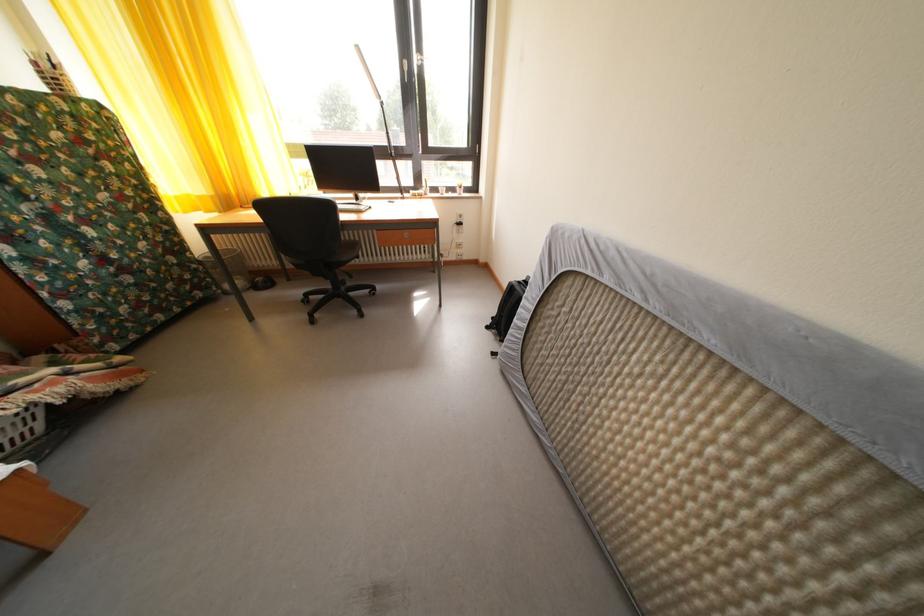
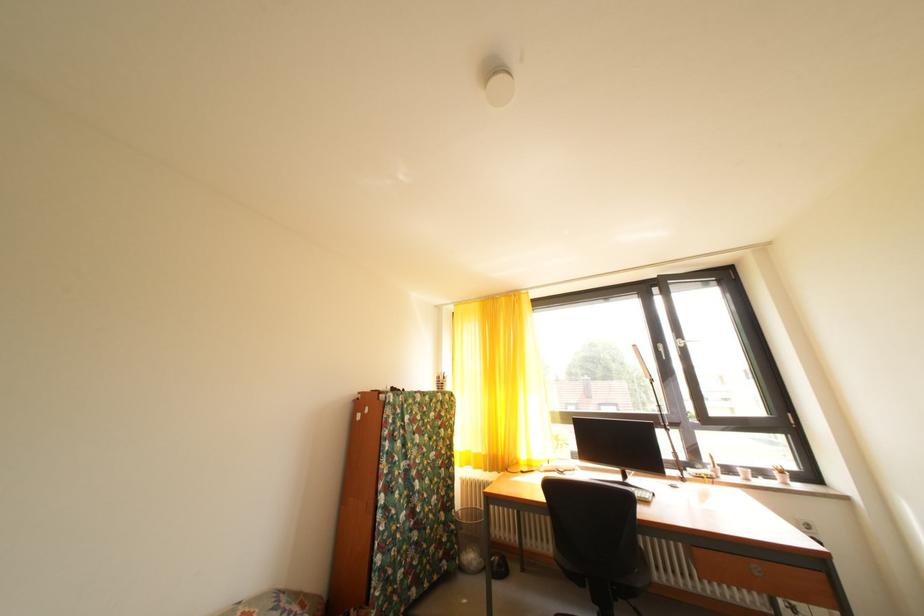
Based on the continuous images, in which direction is the camera rotating?

The rotation direction of the camera is left-up.